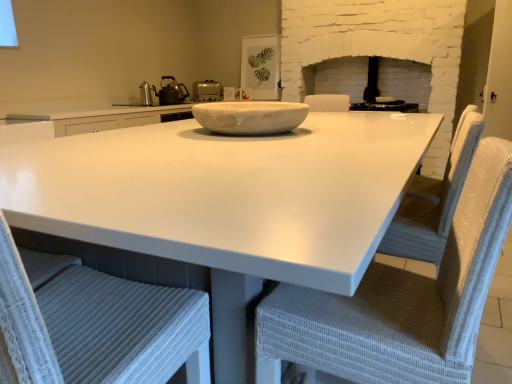
Question: Is white glossy countertop at center oriented away from white wicker chair at center, placed as the first chair when sorted from right to left?

Choices:
 (A) no
 (B) yes

Answer: (A)

Question: Does white glossy countertop at center appear on the right side of white wicker chair at center, placed as the first chair when sorted from right to left?

Choices:
 (A) yes
 (B) no

Answer: (B)

Question: Is white glossy countertop at center aimed at white wicker chair at center, placed as the first chair when sorted from right to left?

Choices:
 (A) no
 (B) yes

Answer: (B)

Question: Is white glossy countertop at center bigger than white wicker chair at center, placed as the first chair when sorted from right to left?

Choices:
 (A) no
 (B) yes

Answer: (B)

Question: Does white glossy countertop at center have a greater height compared to white wicker chair at center, positioned as the second chair in left-to-right order?

Choices:
 (A) no
 (B) yes

Answer: (B)

Question: Can you confirm if white glossy countertop at center is positioned to the left of white wicker chair at center, positioned as the second chair in left-to-right order?

Choices:
 (A) yes
 (B) no

Answer: (A)

Question: From the image's perspective, is white glossy countertop at center under white wicker chair at lower left, the second chair in the right-to-left sequence?

Choices:
 (A) yes
 (B) no

Answer: (B)

Question: Can you confirm if white glossy countertop at center is wider than white wicker chair at lower left, acting as the 1th chair starting from the left?

Choices:
 (A) no
 (B) yes

Answer: (B)

Question: Is white glossy countertop at center at the left side of white wicker chair at lower left, the second chair in the right-to-left sequence?

Choices:
 (A) yes
 (B) no

Answer: (B)

Question: Does white glossy countertop at center have a lesser height compared to white wicker chair at lower left, acting as the 1th chair starting from the left?

Choices:
 (A) no
 (B) yes

Answer: (A)

Question: Is white glossy countertop at center directly adjacent to white wicker chair at lower left, the second chair in the right-to-left sequence?

Choices:
 (A) no
 (B) yes

Answer: (A)

Question: Can you confirm if white glossy countertop at center is taller than white wicker chair at lower left, the second chair in the right-to-left sequence?

Choices:
 (A) no
 (B) yes

Answer: (B)

Question: From a real-world perspective, is white wicker chair at center, placed as the first chair when sorted from right to left, positioned under white marble bowl at center based on gravity?

Choices:
 (A) no
 (B) yes

Answer: (B)